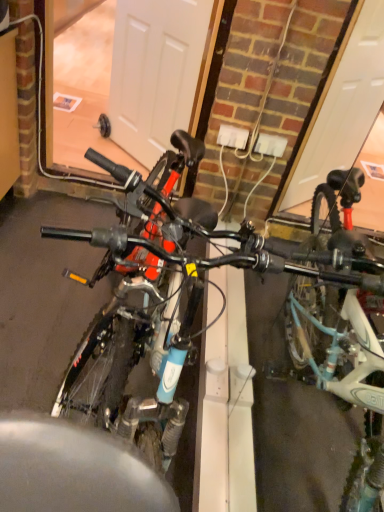
In order to click on teal matte bicycle at right, placed as the second bicycle when sorted from left to right in this screenshot , I will do `click(342, 327)`.

What do you see at coordinates (342, 327) in the screenshot?
I see `teal matte bicycle at right, placed as the second bicycle when sorted from left to right` at bounding box center [342, 327].

The image size is (384, 512). What are the coordinates of `blue matte bicycle at center, the second bicycle viewed from the right` in the screenshot? It's located at (x=202, y=294).

Image resolution: width=384 pixels, height=512 pixels. What are the coordinates of `teal matte bicycle at right, placed as the second bicycle when sorted from left to right` in the screenshot? It's located at (342, 327).

Is white matte door at center to the right of blue matte bicycle at center, the second bicycle viewed from the right, from the viewer's perspective?

No.

Identify the location of the 1st bicycle in front of the white matte door at center, counting from the anchor's position. This screenshot has height=512, width=384. (202, 294).

Can you confirm if white matte door at center is thinner than blue matte bicycle at center, which is the 1th bicycle in left-to-right order?

Indeed, white matte door at center has a lesser width compared to blue matte bicycle at center, which is the 1th bicycle in left-to-right order.

Considering the relative sizes of blue matte bicycle at center, which is the 1th bicycle in left-to-right order, and teal matte bicycle at right, which ranks as the 1th bicycle in right-to-left order, in the image provided, is blue matte bicycle at center, which is the 1th bicycle in left-to-right order, smaller than teal matte bicycle at right, which ranks as the 1th bicycle in right-to-left order,?

Actually, blue matte bicycle at center, which is the 1th bicycle in left-to-right order, might be larger than teal matte bicycle at right, which ranks as the 1th bicycle in right-to-left order.

This screenshot has height=512, width=384. I want to click on bicycle behind the teal matte bicycle at right, which ranks as the 1th bicycle in right-to-left order, so [x=202, y=294].

From the image's perspective, which one is positioned lower, blue matte bicycle at center, the second bicycle viewed from the right, or teal matte bicycle at right, placed as the second bicycle when sorted from left to right?

From the image's view, blue matte bicycle at center, the second bicycle viewed from the right, is below.

Which object is positioned more to the left, blue matte bicycle at center, which is the 1th bicycle in left-to-right order, or teal matte bicycle at right, placed as the second bicycle when sorted from left to right?

Positioned to the left is blue matte bicycle at center, which is the 1th bicycle in left-to-right order.

Which is in front, point (339, 341) or point (139, 126)?

The point (339, 341) is more forward.

From a real-world perspective, between blue matte bicycle at center, which is the 1th bicycle in left-to-right order, and white matte door at center, who is vertically higher?

blue matte bicycle at center, which is the 1th bicycle in left-to-right order.

Considering the sizes of objects blue matte bicycle at center, which is the 1th bicycle in left-to-right order, and white matte door at center in the image provided, who is wider, blue matte bicycle at center, which is the 1th bicycle in left-to-right order, or white matte door at center?

Wider between the two is blue matte bicycle at center, which is the 1th bicycle in left-to-right order.

What's the angular difference between blue matte bicycle at center, which is the 1th bicycle in left-to-right order, and white matte door at center's facing directions?

The angular difference between blue matte bicycle at center, which is the 1th bicycle in left-to-right order, and white matte door at center is 46.5 degrees.

Based on their positions, is teal matte bicycle at right, which ranks as the 1th bicycle in right-to-left order, located to the left or right of blue matte bicycle at center, which is the 1th bicycle in left-to-right order?

Based on their positions, teal matte bicycle at right, which ranks as the 1th bicycle in right-to-left order, is located to the right of blue matte bicycle at center, which is the 1th bicycle in left-to-right order.

Find the location of a particular element. The height and width of the screenshot is (512, 384). bicycle located on the left of teal matte bicycle at right, placed as the second bicycle when sorted from left to right is located at coordinates (202, 294).

Is teal matte bicycle at right, which ranks as the 1th bicycle in right-to-left order, facing away from blue matte bicycle at center, which is the 1th bicycle in left-to-right order?

teal matte bicycle at right, which ranks as the 1th bicycle in right-to-left order, does not have its back to blue matte bicycle at center, which is the 1th bicycle in left-to-right order.

Is teal matte bicycle at right, which ranks as the 1th bicycle in right-to-left order, in contact with white matte door at center?

No, teal matte bicycle at right, which ranks as the 1th bicycle in right-to-left order, is not touching white matte door at center.

Does teal matte bicycle at right, which ranks as the 1th bicycle in right-to-left order, turn towards white matte door at center?

No, teal matte bicycle at right, which ranks as the 1th bicycle in right-to-left order, is not oriented towards white matte door at center.

Which of these two, teal matte bicycle at right, placed as the second bicycle when sorted from left to right, or white matte door at center, is bigger?

Bigger between the two is teal matte bicycle at right, placed as the second bicycle when sorted from left to right.

Is point (362, 315) closer or farther from the camera than point (189, 73)?

Point (362, 315) is closer to the camera than point (189, 73).

Considering the positions of points (151, 155) and (328, 379), is point (151, 155) farther from camera compared to point (328, 379)?

Yes, point (151, 155) is behind point (328, 379).

Measure the distance from white matte door at center to teal matte bicycle at right, placed as the second bicycle when sorted from left to right.

The distance of white matte door at center from teal matte bicycle at right, placed as the second bicycle when sorted from left to right, is 4.37 feet.

Is white matte door at center touching teal matte bicycle at right, which ranks as the 1th bicycle in right-to-left order?

No, white matte door at center is not with teal matte bicycle at right, which ranks as the 1th bicycle in right-to-left order.

Identify the location of bicycle that is the 1st object to the right of the white matte door at center, starting at the anchor. (202, 294).

Find the location of `bicycle that is below the teal matte bicycle at right, placed as the second bicycle when sorted from left to right (from the image's perspective)`. bicycle that is below the teal matte bicycle at right, placed as the second bicycle when sorted from left to right (from the image's perspective) is located at coordinates (202, 294).

Looking at the image, which one is located closer to teal matte bicycle at right, placed as the second bicycle when sorted from left to right, blue matte bicycle at center, the second bicycle viewed from the right, or white matte door at center?

blue matte bicycle at center, the second bicycle viewed from the right, is closer to teal matte bicycle at right, placed as the second bicycle when sorted from left to right.

Which object lies nearer to the anchor point white matte door at center, teal matte bicycle at right, placed as the second bicycle when sorted from left to right, or blue matte bicycle at center, which is the 1th bicycle in left-to-right order?

teal matte bicycle at right, placed as the second bicycle when sorted from left to right.

Based on their spatial positions, is white matte door at center or teal matte bicycle at right, which ranks as the 1th bicycle in right-to-left order, further from blue matte bicycle at center, which is the 1th bicycle in left-to-right order?

white matte door at center lies further to blue matte bicycle at center, which is the 1th bicycle in left-to-right order, than the other object.

Estimate the real-world distances between objects in this image. Which object is closer to blue matte bicycle at center, which is the 1th bicycle in left-to-right order, teal matte bicycle at right, placed as the second bicycle when sorted from left to right, or white matte door at center?

teal matte bicycle at right, placed as the second bicycle when sorted from left to right.

Looking at the image, which one is located closer to white matte door at center, blue matte bicycle at center, the second bicycle viewed from the right, or teal matte bicycle at right, placed as the second bicycle when sorted from left to right?

The object closer to white matte door at center is teal matte bicycle at right, placed as the second bicycle when sorted from left to right.

From the image, which object appears to be farther from teal matte bicycle at right, which ranks as the 1th bicycle in right-to-left order, white matte door at center or blue matte bicycle at center, which is the 1th bicycle in left-to-right order?

Answer: The object further to teal matte bicycle at right, which ranks as the 1th bicycle in right-to-left order, is white matte door at center.

The height and width of the screenshot is (512, 384). Find the location of `bicycle located between teal matte bicycle at right, placed as the second bicycle when sorted from left to right, and white matte door at center in the depth direction`. bicycle located between teal matte bicycle at right, placed as the second bicycle when sorted from left to right, and white matte door at center in the depth direction is located at coordinates (202, 294).